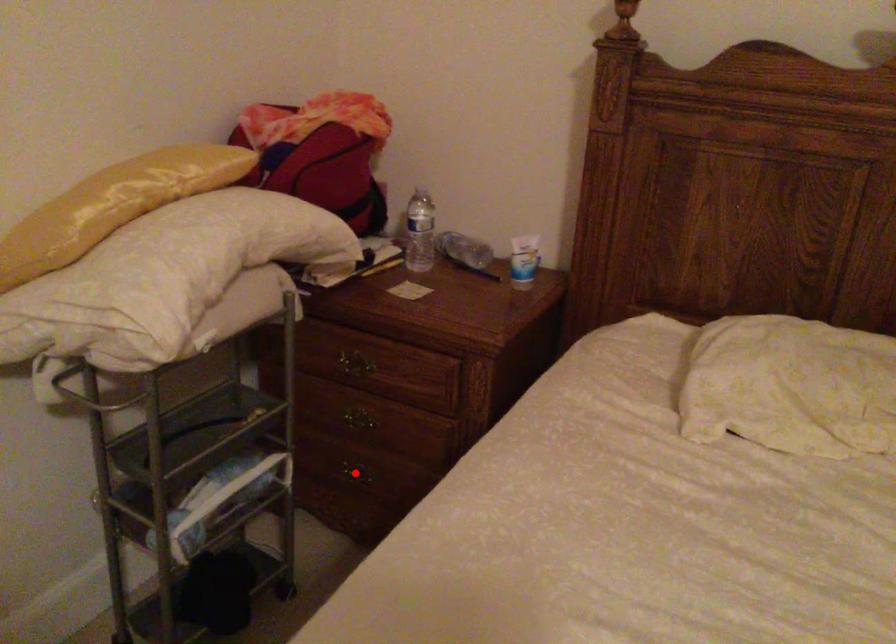
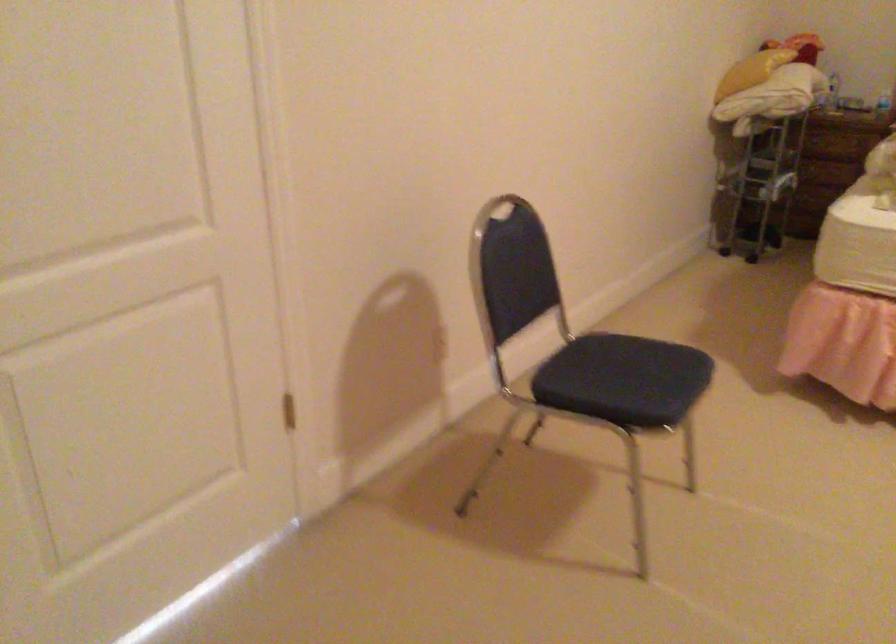
Question: I am providing you with two images of the same scene from different viewpoints. A red point is marked on the first image. Is the red point's position out of view in image 2?

Choices:
 (A) Yes
 (B) No

Answer: (A)